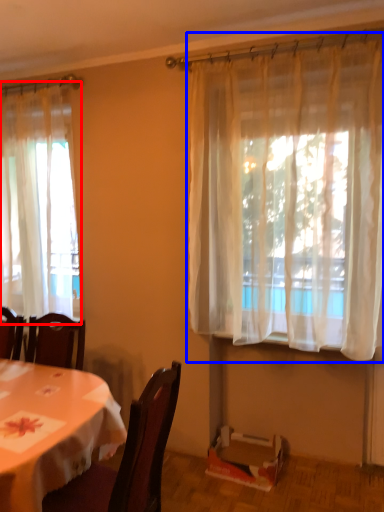
Question: Which of the following is the farthest to the observer, curtain (highlighted by a red box) or curtain (highlighted by a blue box)?

Choices:
 (A) curtain
 (B) curtain

Answer: (A)